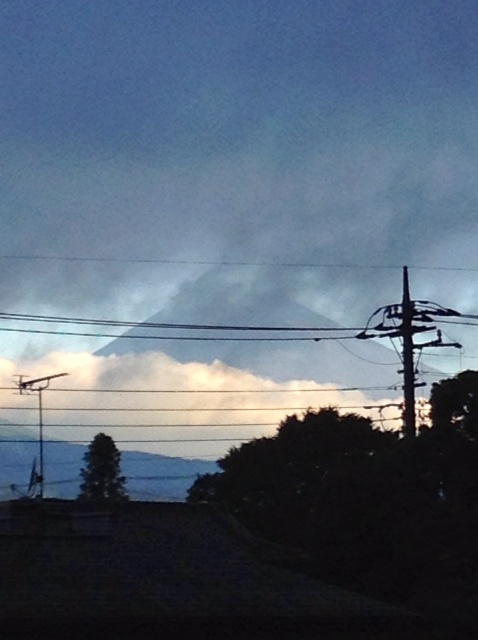
Does black wire at center have a greater height compared to metallic wire at left?

Incorrect, black wire at center's height is not larger of metallic wire at left's.

Which of these two, black wire at center or metallic wire at left, stands shorter?

With less height is black wire at center.

Image resolution: width=478 pixels, height=640 pixels. Identify the location of black wire at center. pos(173,323).

Who is lower down, metallic wire at right or metallic wire at left?

metallic wire at left is below.

Based on the photo, who is shorter, metallic wire at right or metallic wire at left?

metallic wire at left

What do you see at coordinates (409, 340) in the screenshot? I see `metallic wire at right` at bounding box center [409, 340].

Find the location of a particular element. The height and width of the screenshot is (640, 478). metallic wire at right is located at coordinates (409, 340).

Who is higher up, metallic wire at right or black wire at center?

metallic wire at right is above.

Based on the photo, can you confirm if metallic wire at right is smaller than black wire at center?

No.

Does point (431, 323) come farther from viewer compared to point (356, 326)?

No, it is not.

Identify the location of metallic wire at right. The height and width of the screenshot is (640, 478). (409, 340).